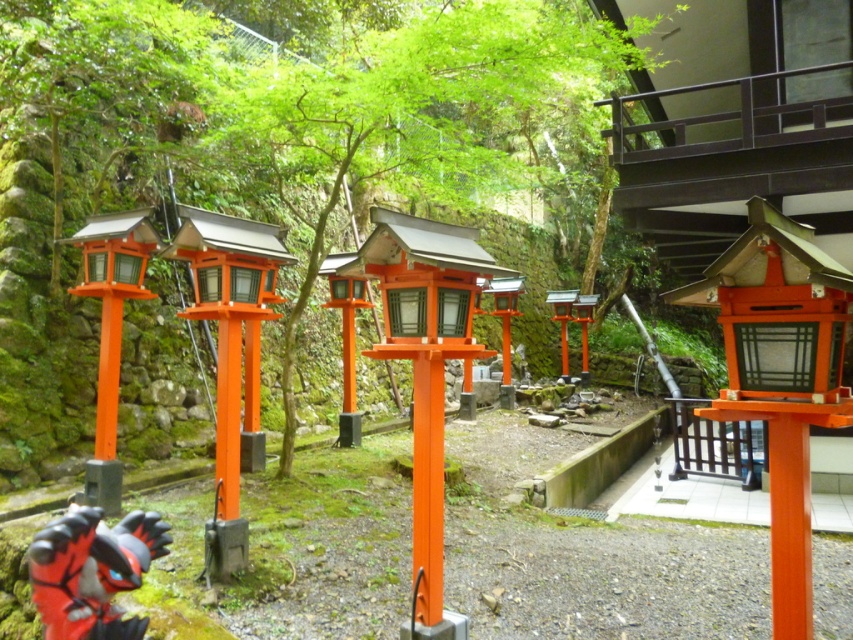
Question: Among these objects, which one is farthest from the camera?

Choices:
 (A) orange glossy lantern at center
 (B) orange matte lantern at center

Answer: (A)

Question: Which of the following is the farthest from the observer?

Choices:
 (A) (792, 326)
 (B) (579, 380)
 (C) (717, 435)
 (D) (439, 243)

Answer: (B)

Question: Does white tile floor at lower right appear on the left side of orange matte lantern at center?

Choices:
 (A) no
 (B) yes

Answer: (A)

Question: Which object is positioned closest to the matte orange wooden lantern at center?

Choices:
 (A) orange matte/light wood lantern at center
 (B) black matte gate at center

Answer: (A)

Question: Can you confirm if orange matte/light wood lantern at center is positioned above orange matte lantern at center?

Choices:
 (A) yes
 (B) no

Answer: (B)

Question: Considering the relative positions of matte orange wooden lantern at center and orange glossy lantern at center in the image provided, where is matte orange wooden lantern at center located with respect to orange glossy lantern at center?

Choices:
 (A) right
 (B) left

Answer: (B)